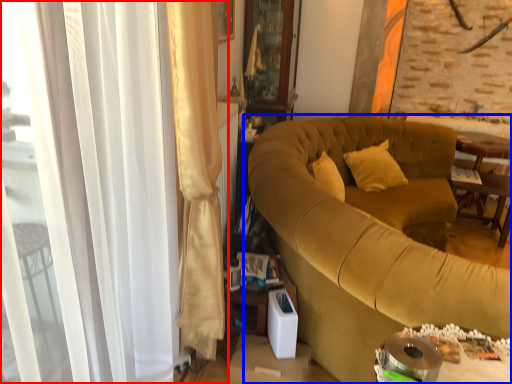
Question: Which object appears closest to the camera in this image, curtain (highlighted by a red box) or studio couch (highlighted by a blue box)?

Choices:
 (A) curtain
 (B) studio couch

Answer: (A)